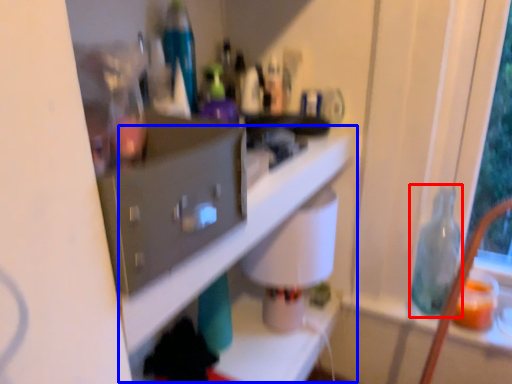
Question: Which point is closer to the camera, bottle (highlighted by a red box) or shelf (highlighted by a blue box)?

Choices:
 (A) bottle
 (B) shelf

Answer: (B)